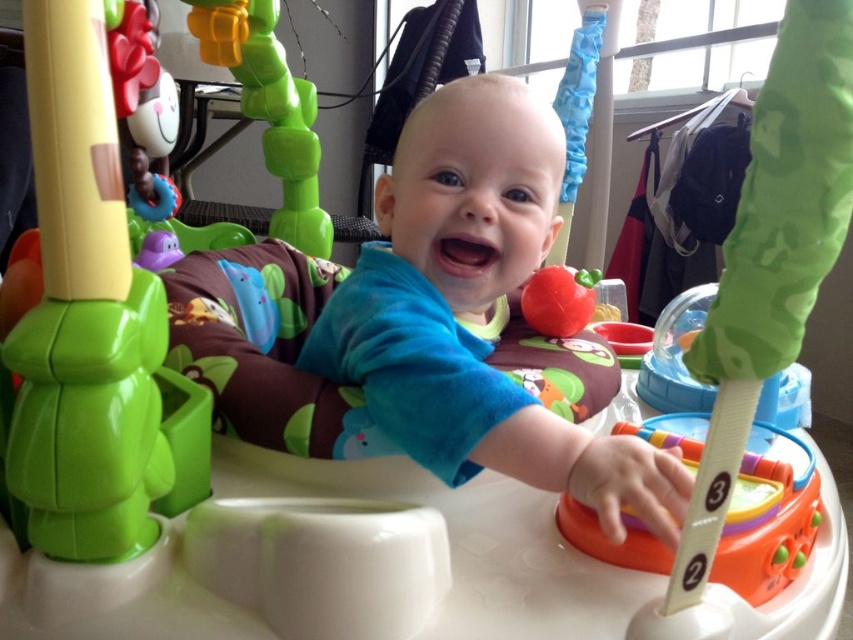
You are a parent trying to reach the rubberized red apple at center to give it to the blue soft baby at center. Which direction should you move the apple to so the baby can grab it?

You should move the rubberized red apple at center to the left since the blue soft baby at center is positioned to the left of it.

You are a parent trying to clean up the baby activity center. You need to remove the orange plastic number stick at center and the rubberized red apple at center. Which object should you remove first to avoid knocking over the other?

You should remove the orange plastic number stick at center first because it is positioned under the rubberized red apple at center. Removing the lower one first will prevent the apple from falling when you take away the stick.

You are a parent trying to organize the baby toys in the activity center. You want to place the orange plastic number stick at center and the rubberized red apple at center in a straight line from left to right. Which toy should you place first on the left side?

The rubberized red apple at center should be placed first on the left side since the orange plastic number stick at center is to the right of it.